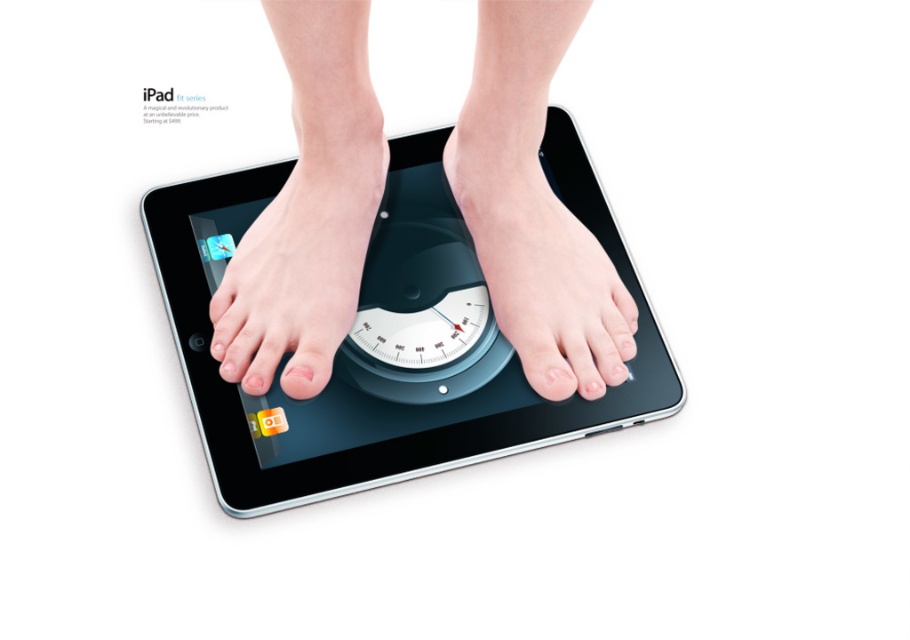
You are a delivery person who needs to check the weight of a package. You have a digital scale that looks like the black glossy tablet at center and a package that looks like the pale skin foot at center. Can you place the package on the scale to get an accurate reading?

The black glossy tablet at center and pale skin foot at center are 4.02 inches apart from each other, so no, the package cannot be placed on the scale to get an accurate reading because they are not close enough.